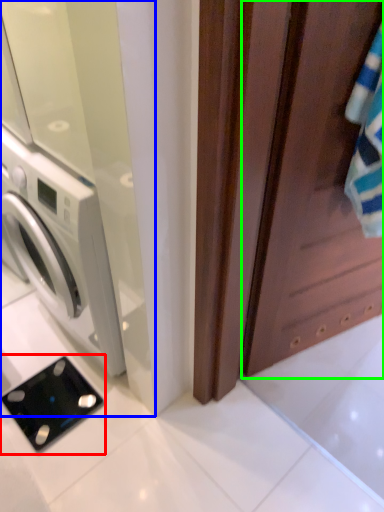
Question: Which object is the farthest from appliance (highlighted by a red box)? Choose among these: screen door (highlighted by a blue box) or screen door (highlighted by a green box).

Choices:
 (A) screen door
 (B) screen door

Answer: (B)